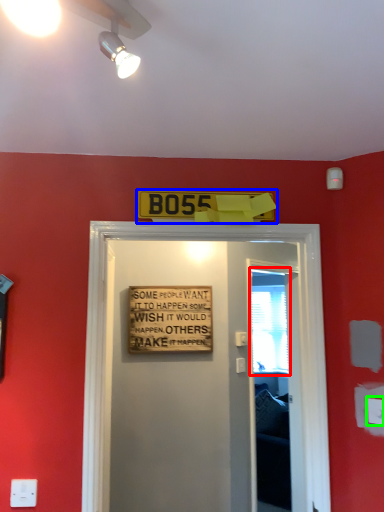
Question: Estimate the real-world distances between objects in this image. Which object is closer to window screen (highlighted by a red box), warning sign (highlighted by a blue box) or electric outlet (highlighted by a green box)?

Choices:
 (A) warning sign
 (B) electric outlet

Answer: (A)